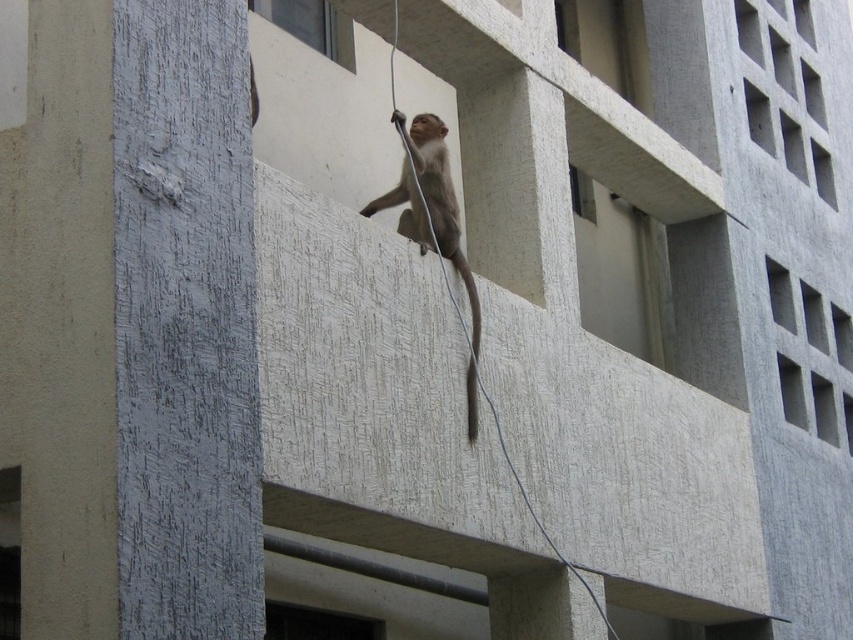
Measure the distance from fuzzy gray monkey at center to brown fur tail at center.

fuzzy gray monkey at center is 24.82 inches away from brown fur tail at center.

Can you confirm if fuzzy gray monkey at center is thinner than brown fur tail at center?

Incorrect, fuzzy gray monkey at center's width is not less than brown fur tail at center's.

Identify the location of fuzzy gray monkey at center. (445, 228).

Where is `fuzzy gray monkey at center`? The width and height of the screenshot is (853, 640). fuzzy gray monkey at center is located at coordinates tap(445, 228).